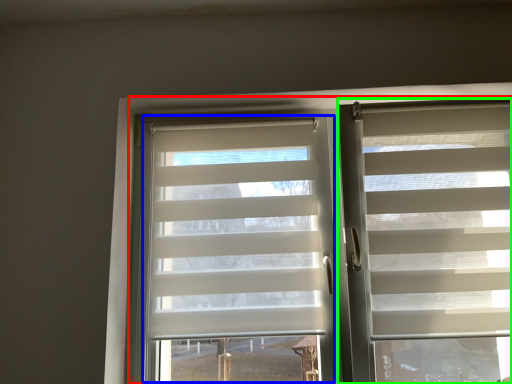
Question: Considering the real-world distances, which object is closest to bay window (highlighted by a red box)? glass door (highlighted by a blue box) or window blind (highlighted by a green box).

Choices:
 (A) glass door
 (B) window blind

Answer: (A)